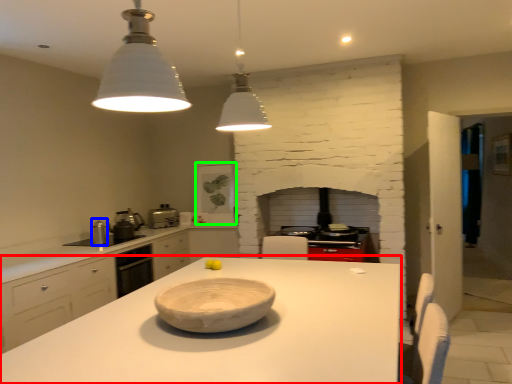
Question: Which is farther away from countertop (highlighted by a red box)? appliance (highlighted by a blue box) or appliance (highlighted by a green box)?

Choices:
 (A) appliance
 (B) appliance

Answer: (B)